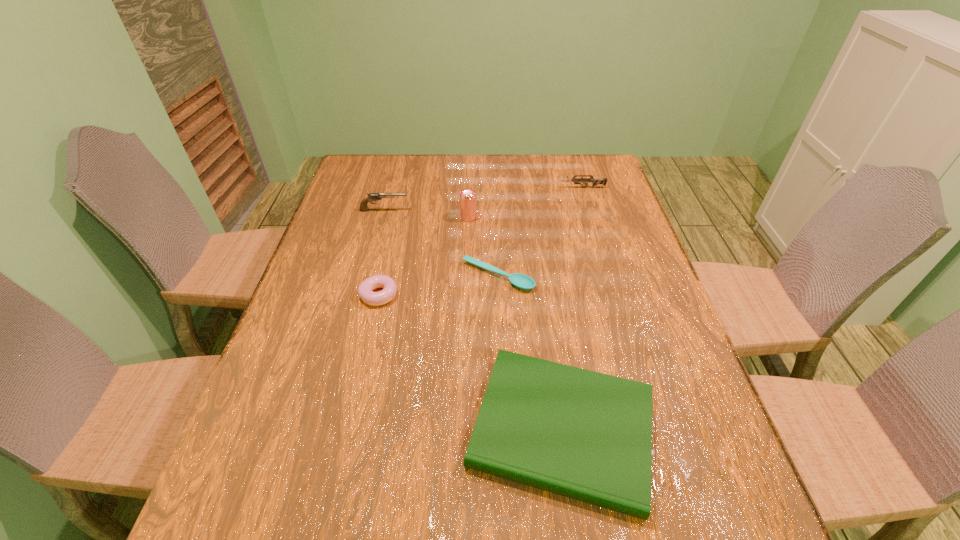
Locate which object is the closest to the shortest object. Please provide its 2D coordinates. Your answer should be formatted as a tuple, i.e. [(x, y)], where the tuple contains the x and y coordinates of a point satisfying the conditions above.

[(365, 290)]

Select which object appears as the fifth closest to the nearest object. Please provide its 2D coordinates. Your answer should be formatted as a tuple, i.e. [(x, y)], where the tuple contains the x and y coordinates of a point satisfying the conditions above.

[(595, 181)]

Locate an element on the screen. The image size is (960, 540). free space in the image that satisfies the following two spatial constraints: 1. aiming along the barrel of the second farthest object; 2. on the back side of the paperback book is located at coordinates (326, 430).

Identify the location of vacant space that satisfies the following two spatial constraints: 1. aiming along the barrel of the left gun; 2. on the back side of the beer can. The width and height of the screenshot is (960, 540). (382, 218).

The width and height of the screenshot is (960, 540). In order to click on vacant position in the image that satisfies the following two spatial constraints: 1. on the front side of the beer can; 2. on the left side of the shortest object in this screenshot , I will do `click(467, 276)`.

At what (x,y) coordinates should I click in order to perform the action: click on vacant region that satisfies the following two spatial constraints: 1. on the back side of the spoon; 2. aiming along the barrel of the second tallest object. Please return your answer as a coordinate pair (x, y). This screenshot has height=540, width=960. Looking at the image, I should click on (495, 211).

Identify the location of free spot that satisfies the following two spatial constraints: 1. aiming along the barrel of the nearest object; 2. on the left side of the left gun. (326, 430).

Image resolution: width=960 pixels, height=540 pixels. Identify the location of free spot that satisfies the following two spatial constraints: 1. aiming along the barrel of the tallest object; 2. on the right side of the nearer gun. (382, 218).

The image size is (960, 540). Find the location of `free space in the image that satisfies the following two spatial constraints: 1. aiming along the barrel of the spoon; 2. on the left side of the taller gun`. free space in the image that satisfies the following two spatial constraints: 1. aiming along the barrel of the spoon; 2. on the left side of the taller gun is located at coordinates (367, 276).